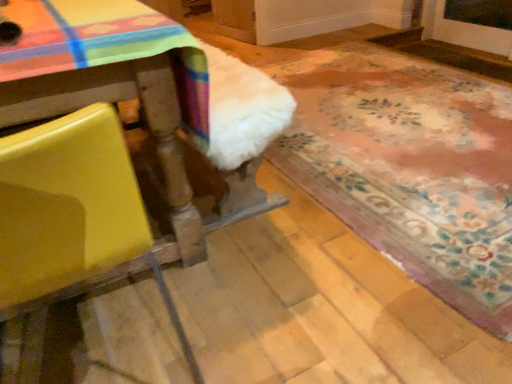
Question: Visually, is yellow matte chair at left positioned to the left or to the right of white fluffy rug at lower right?

Choices:
 (A) right
 (B) left

Answer: (B)

Question: Is point (2, 167) positioned closer to the camera than point (476, 112)?

Choices:
 (A) closer
 (B) farther

Answer: (A)

Question: Considering the positions of yellow matte chair at left and white fluffy rug at lower right in the image, is yellow matte chair at left taller or shorter than white fluffy rug at lower right?

Choices:
 (A) short
 (B) tall

Answer: (B)

Question: From the image's perspective, is white fluffy rug at lower right located above or below yellow matte chair at left?

Choices:
 (A) above
 (B) below

Answer: (A)

Question: Considering the positions of point (458, 124) and point (8, 211), is point (458, 124) closer or farther from the camera than point (8, 211)?

Choices:
 (A) farther
 (B) closer

Answer: (A)

Question: Visually, is white fluffy rug at lower right positioned to the left or to the right of yellow matte chair at left?

Choices:
 (A) left
 (B) right

Answer: (B)

Question: From a real-world perspective, is white fluffy rug at lower right physically located above or below yellow matte chair at left?

Choices:
 (A) below
 (B) above

Answer: (A)